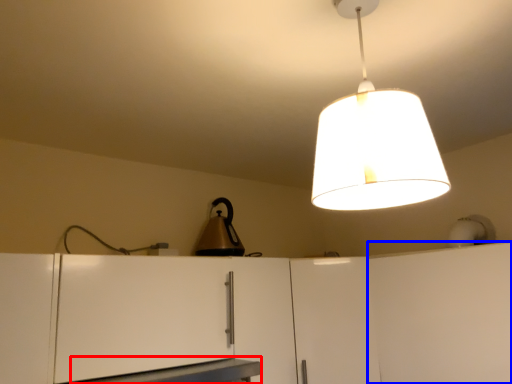
Question: Which object appears closest to the camera in this image, table (highlighted by a red box) or cabinetry (highlighted by a blue box)?

Choices:
 (A) table
 (B) cabinetry

Answer: (A)